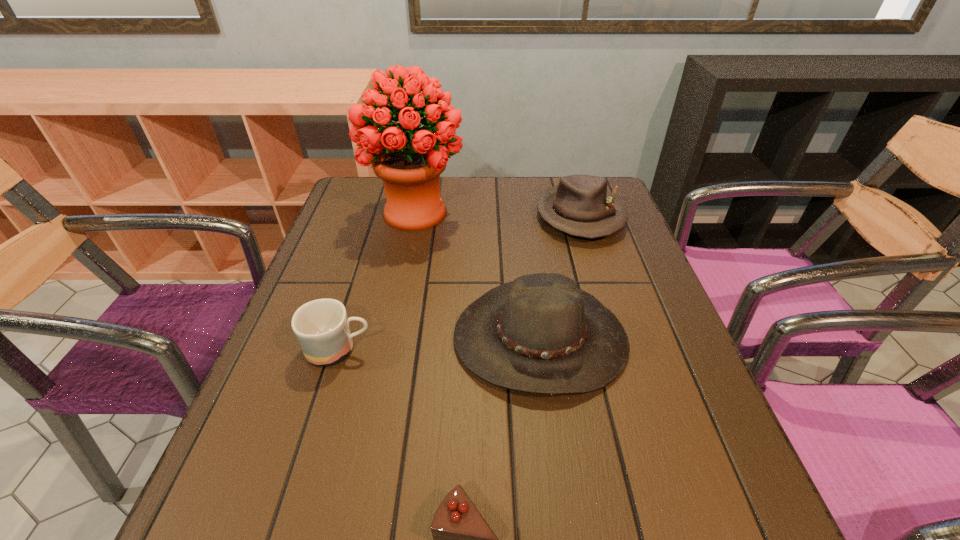
Locate an element on the screen. bouquet is located at coordinates (409, 159).

Where is `the nearer hat`? The height and width of the screenshot is (540, 960). the nearer hat is located at coordinates (540, 333).

Where is `the taller hat`? Image resolution: width=960 pixels, height=540 pixels. the taller hat is located at coordinates (540, 333).

You are a GUI agent. You are given a task and a screenshot of the screen. Output one action in this format:
    pyautogui.click(x=<x>, y=<y>)
    Task: Click on the shorter hat
    This screenshot has height=540, width=960.
    Given the screenshot: What is the action you would take?
    pyautogui.click(x=580, y=205)

I want to click on mug, so click(x=321, y=326).

I want to click on free space located on the right of the tallest object, so click(576, 213).

This screenshot has height=540, width=960. What are the coordinates of `vacant point located on the front-facing side of the fourth shortest object` in the screenshot? It's located at (555, 446).

You are a GUI agent. You are given a task and a screenshot of the screen. Output one action in this format:
    pyautogui.click(x=<x>, y=<y>)
    Task: Click on the free location located on the decorative side of the farther hat
    This screenshot has width=960, height=540.
    Given the screenshot: What is the action you would take?
    pyautogui.click(x=623, y=356)

Image resolution: width=960 pixels, height=540 pixels. What are the coordinates of `free region located on the side with the handle of the mug` in the screenshot? It's located at (511, 349).

Identify the location of bouquet situated at the far edge. This screenshot has width=960, height=540. (409, 159).